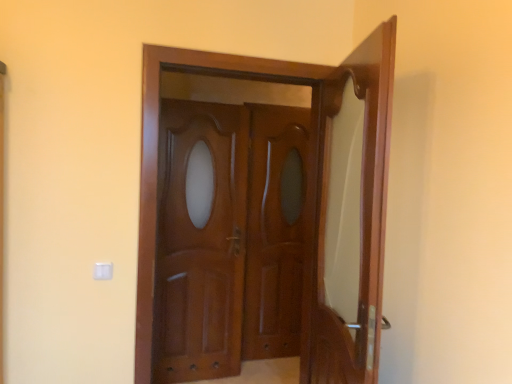
Question: Relative to mahogany wood door at right, which appears as the 1th door when viewed from the right, is mahogany wood door at center in front or behind?

Choices:
 (A) front
 (B) behind

Answer: (B)

Question: Based on their positions, is mahogany wood door at center located to the left or right of mahogany wood door at right, positioned as the 2th door in left-to-right order?

Choices:
 (A) right
 (B) left

Answer: (B)

Question: Based on their relative distances, which object is nearer to the glossy wood door at center?

Choices:
 (A) mahogany wood door at right, positioned as the 2th door in left-to-right order
 (B) glossy wood door at center, positioned as the first door in left-to-right order
 (C) mahogany wood door at center

Answer: (C)

Question: Which is farther from the glossy wood door at center, which is the 2th door in right-to-left order?

Choices:
 (A) mahogany wood door at center
 (B) mahogany wood door at right, which appears as the 1th door when viewed from the right
 (C) glossy wood door at center

Answer: (C)